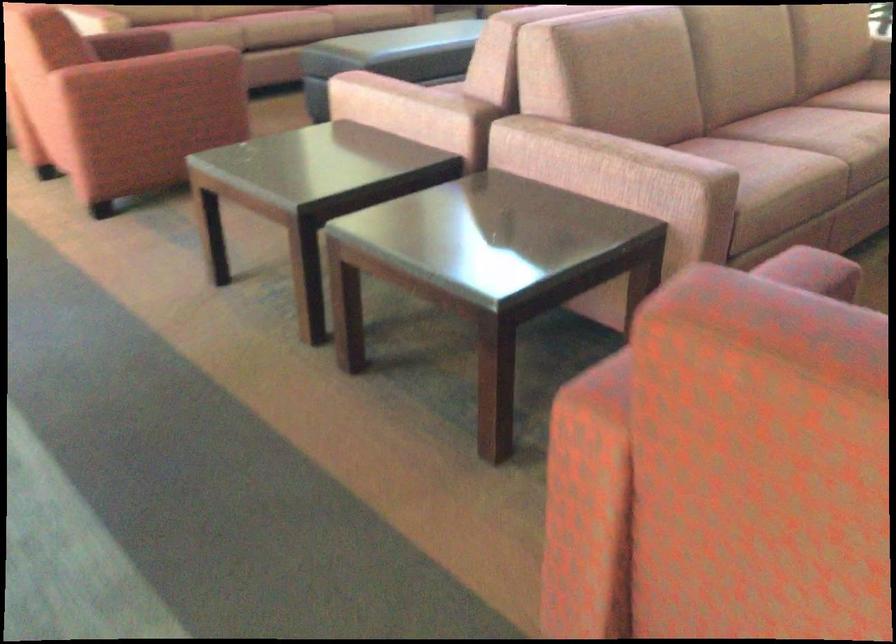
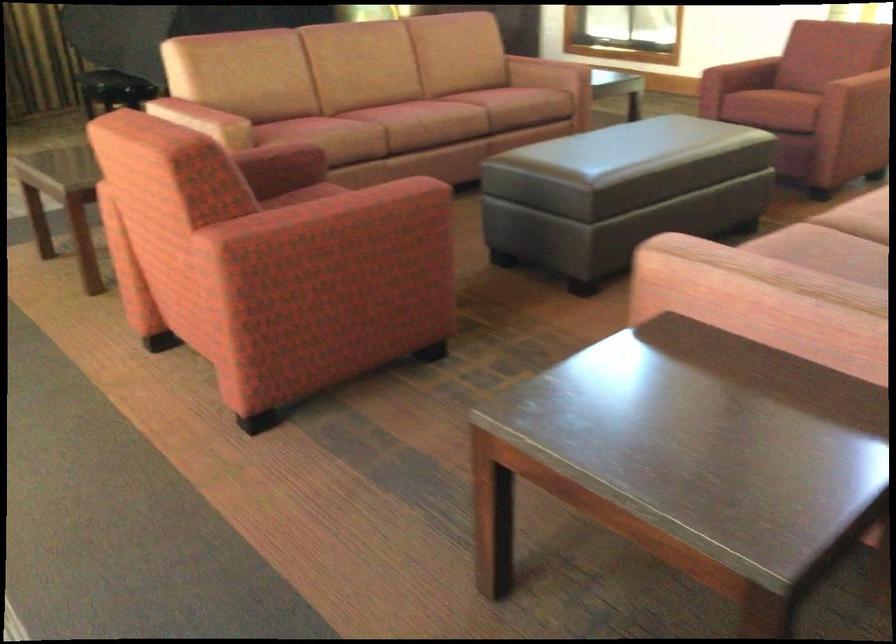
The images are taken continuously from a first-person perspective. In which direction are you moving?

The movement direction of the cameraman is left, forward.